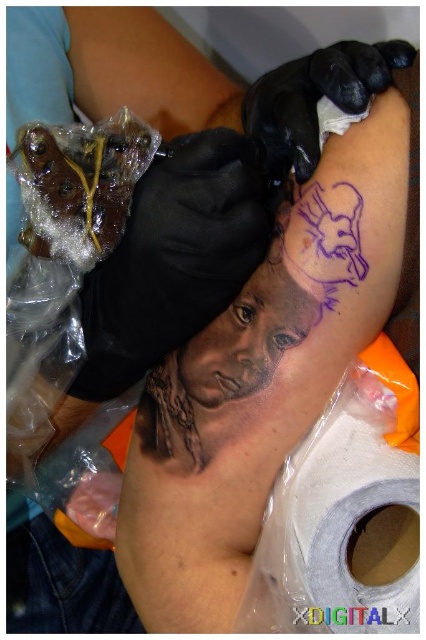
In the scene shown: You are a photographer in a bathroom and want to take a picture of the white matte toilet paper at lower right. Where should you position your camera to capture it clearly?

Position the camera at a low angle, pointing towards the lower right area where the white matte toilet paper at lower right is located, ensuring it is centered in the frame for clarity.

You are a home decorator who needs to place a 9 inch decorative item between the white matte toilet paper at lower right and the black rubber glove at upper center. Is there enough space?

The white matte toilet paper at lower right is 8.97 inches from the black rubber glove at upper center, so there is not enough space to place a 9 inch decorative item between them.